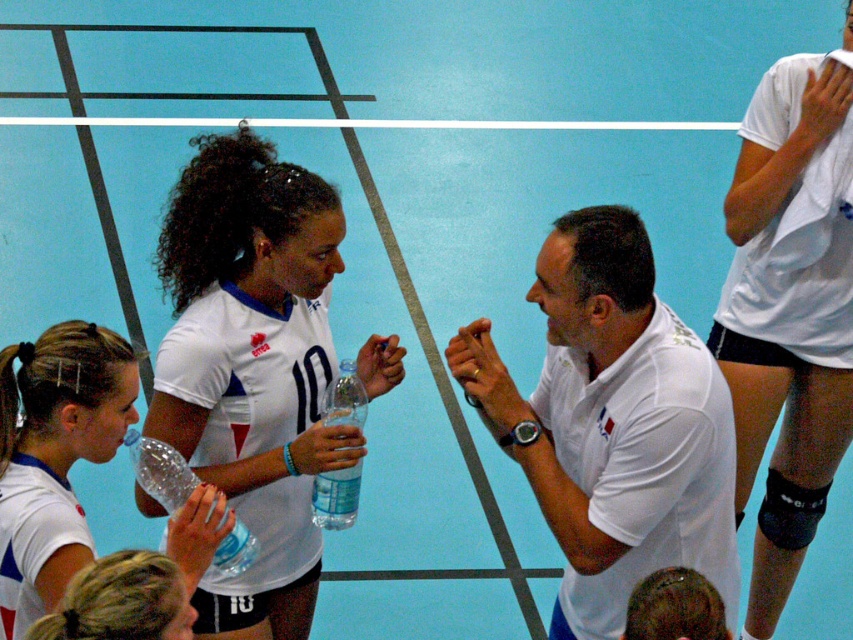
What do you see at coordinates (612, 422) in the screenshot? The height and width of the screenshot is (640, 853). I see `white matte shirt at center` at bounding box center [612, 422].

Between white matte shirt at center and clear plastic water bottle at lower left, which one is positioned lower?

clear plastic water bottle at lower left is lower down.

You are a GUI agent. You are given a task and a screenshot of the screen. Output one action in this format:
    pyautogui.click(x=<x>, y=<y>)
    Task: Click on the white matte shirt at center
    The width and height of the screenshot is (853, 640).
    Given the screenshot: What is the action you would take?
    pyautogui.click(x=612, y=422)

Where is `white matte shirt at center`? Image resolution: width=853 pixels, height=640 pixels. white matte shirt at center is located at coordinates (612, 422).

What do you see at coordinates (54, 456) in the screenshot?
I see `clear plastic water bottle at lower left` at bounding box center [54, 456].

Who is more forward, [94,422] or [328,529]?

Point [94,422] is more forward.

Who is more distant from viewer, (1, 579) or (340, 512)?

The point (340, 512) is more distant.

Find the location of a particular element. clear plastic water bottle at lower left is located at coordinates (54, 456).

Can you confirm if clear plastic water bottle at lower left is positioned above transparent plastic bottle at center?

Correct, clear plastic water bottle at lower left is located above transparent plastic bottle at center.

Looking at this image, does clear plastic water bottle at lower left have a smaller size compared to transparent plastic bottle at center?

No.

This screenshot has width=853, height=640. Identify the location of clear plastic water bottle at lower left. click(54, 456).

Locate an element on the screen. The height and width of the screenshot is (640, 853). clear plastic water bottle at lower left is located at coordinates (54, 456).